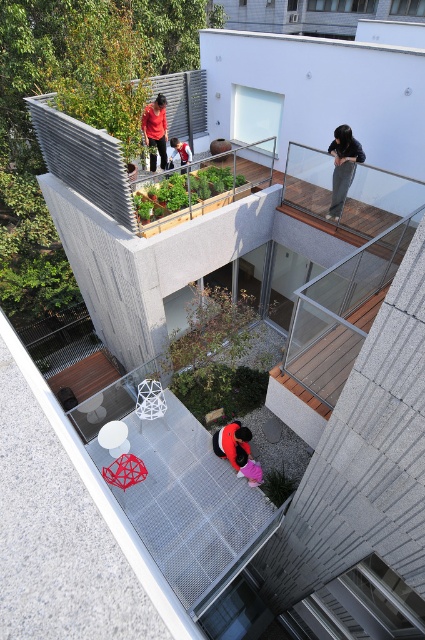
Is dark gray pants at upper right positioned behind matte black jacket at center?

Yes.

Which is in front, point (331, 182) or point (231, 461)?

Point (231, 461) is in front.

Identify the location of dark gray pants at upper right. This screenshot has height=640, width=425. (342, 166).

Is wooden deck at upper center to the left of matte red shirt at upper center from the viewer's perspective?

Correct, you'll find wooden deck at upper center to the left of matte red shirt at upper center.

Can you confirm if wooden deck at upper center is taller than matte red shirt at upper center?

Incorrect, wooden deck at upper center's height is not larger of matte red shirt at upper center's.

Locate an element on the screen. The width and height of the screenshot is (425, 640). wooden deck at upper center is located at coordinates (87, 168).

Between dark gray pants at upper right and matte pink dress at lower center, which one has less height?

Standing shorter between the two is matte pink dress at lower center.

Does dark gray pants at upper right have a greater width compared to matte pink dress at lower center?

Indeed, dark gray pants at upper right has a greater width compared to matte pink dress at lower center.

Where is `dark gray pants at upper right`? dark gray pants at upper right is located at coordinates (342, 166).